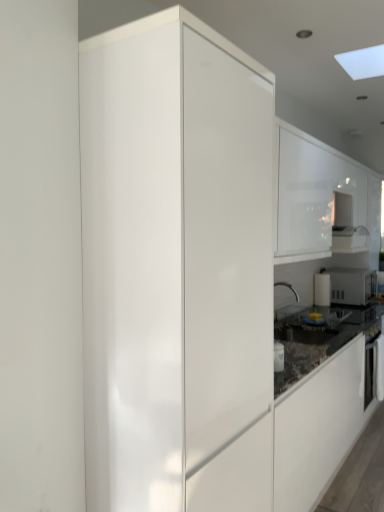
Question: Considering the positions of white glossy cabinet at upper right, which appears as the 2th cabinetry when viewed from the front, and white glossy microwave at right in the image, is white glossy cabinet at upper right, which appears as the 2th cabinetry when viewed from the front, wider or thinner than white glossy microwave at right?

Choices:
 (A) wide
 (B) thin

Answer: (B)

Question: In terms of size, does white glossy cabinet at upper right, which appears as the 2th cabinetry when viewed from the front, appear bigger or smaller than white glossy microwave at right?

Choices:
 (A) small
 (B) big

Answer: (B)

Question: Estimate the real-world distances between objects in this image. Which object is farther from the glossy white cabinet at center, which is the first cabinetry in front-to-back order?

Choices:
 (A) black glossy oven at right
 (B) white glossy microwave at right
 (C) white glossy cabinet at upper right, which is the first cabinetry from right to left

Answer: (B)

Question: Which object is the closest to the white glossy cabinet at upper right, which appears as the 2th cabinetry when viewed from the front?

Choices:
 (A) glossy white cabinet at center, marked as the second cabinetry in a back-to-front arrangement
 (B) white glossy microwave at right
 (C) black glossy oven at right

Answer: (B)